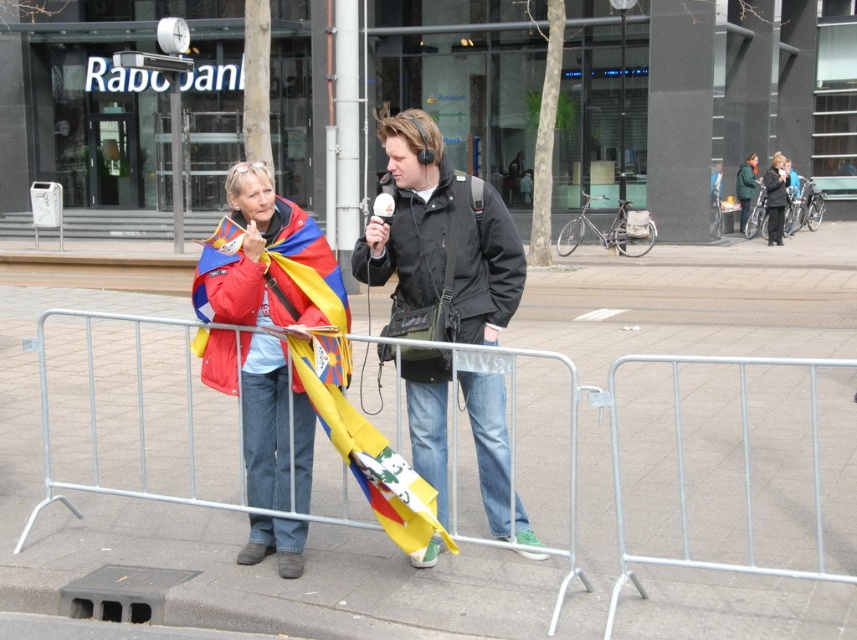
Does metal at center have a greater height compared to black matte jacket at center?

Incorrect, metal at center's height is not larger of black matte jacket at center's.

Does metal at center lie behind black matte jacket at center?

That is True.

Does point (219, 524) come behind point (501, 529)?

Yes, it is.

You are a GUI agent. You are given a task and a screenshot of the screen. Output one action in this format:
    pyautogui.click(x=<x>, y=<y>)
    Task: Click on the metal at center
    The image size is (857, 640).
    Given the screenshot: What is the action you would take?
    point(454,493)

Between point (273, 292) and point (740, 230), which one is positioned behind?

The point (740, 230) is more distant.

Which is above, matte red jacket at center or dark green jacket at center?

Positioned higher is dark green jacket at center.

The width and height of the screenshot is (857, 640). Describe the element at coordinates (267, 262) in the screenshot. I see `matte red jacket at center` at that location.

Image resolution: width=857 pixels, height=640 pixels. In order to click on matte red jacket at center in this screenshot , I will do `click(267, 262)`.

Who is positioned more to the left, metal at center or dark green jacket at center?

metal at center is more to the left.

Is metal at center to the left of dark green jacket at center from the viewer's perspective?

Indeed, metal at center is positioned on the left side of dark green jacket at center.

Which is behind, point (12, 324) or point (747, 211)?

Point (747, 211)

Find the location of a particular element. The height and width of the screenshot is (640, 857). metal at center is located at coordinates (454, 493).